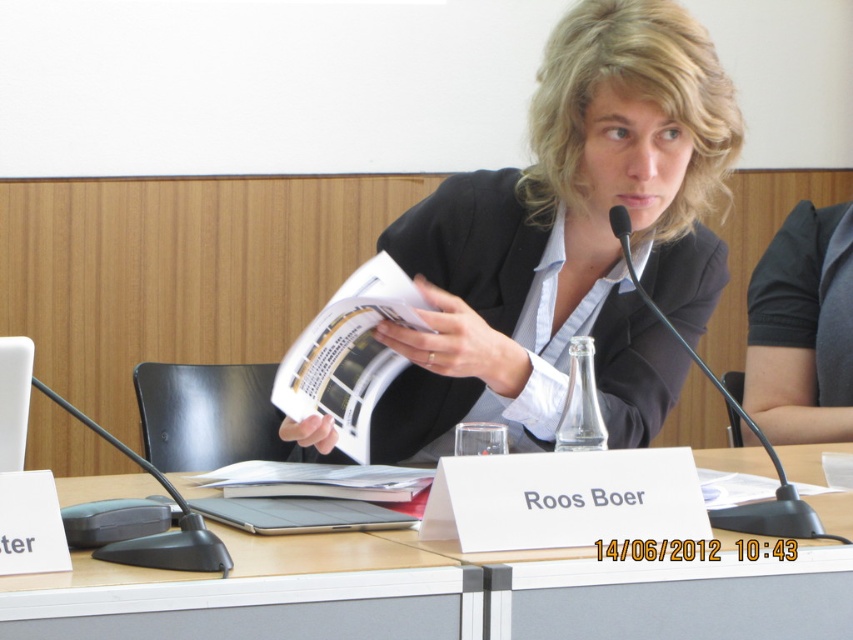
Question: Does dark gray fabric at right appear on the right side of white plastic laptop at left?

Choices:
 (A) no
 (B) yes

Answer: (B)

Question: Does dark gray fabric at right lie in front of black plastic microphone at left?

Choices:
 (A) no
 (B) yes

Answer: (A)

Question: Which object is the farthest from the white plastic laptop at left?

Choices:
 (A) wooden table at center
 (B) matte black suit at center
 (C) dark gray fabric at right
 (D) black plastic microphone at left

Answer: (C)

Question: Among these points, which one is farthest from the camera?

Choices:
 (A) (285, 540)
 (B) (764, 531)
 (C) (782, 428)
 (D) (154, 560)

Answer: (C)

Question: Which point appears closest to the camera in this image?

Choices:
 (A) (747, 416)
 (B) (793, 579)
 (C) (397, 228)
 (D) (134, 561)

Answer: (D)

Question: Does wooden table at center appear on the right side of white plastic laptop at left?

Choices:
 (A) yes
 (B) no

Answer: (A)